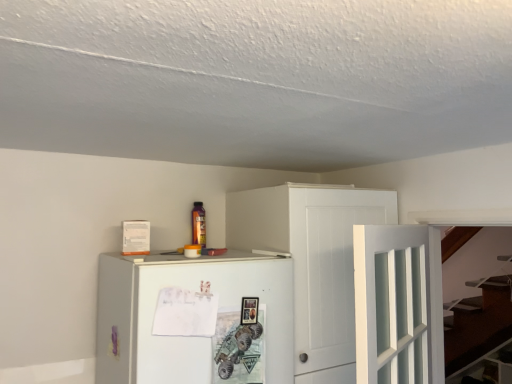
Question: Does point (256, 375) appear closer or farther from the camera than point (391, 352)?

Choices:
 (A) farther
 (B) closer

Answer: (A)

Question: Based on their sizes in the image, would you say white matte refrigerator at center is bigger or smaller than white glass door at center-right?

Choices:
 (A) big
 (B) small

Answer: (A)

Question: Considering the real-world distances, which object is farthest from the white glass door at center-right?

Choices:
 (A) white matte refrigerator at center
 (B) white wood cabinet at upper center

Answer: (A)

Question: Which is nearer to the white wood cabinet at upper center?

Choices:
 (A) white glass door at center-right
 (B) white matte refrigerator at center

Answer: (B)